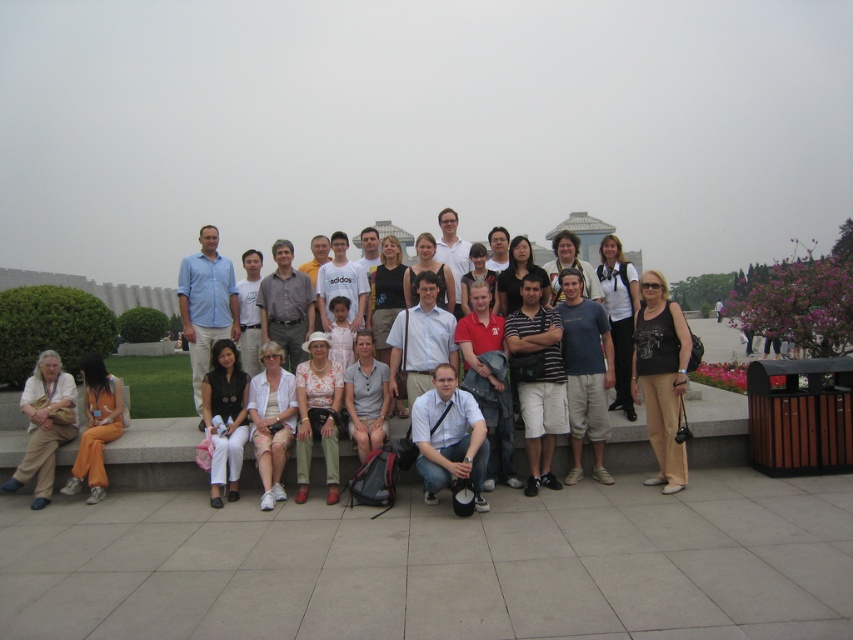
Question: Which point is closer to the camera?

Choices:
 (A) (53, 461)
 (B) (68, 488)

Answer: (B)

Question: Does light beige pants at lower left appear under orange cotton pants at lower left?

Choices:
 (A) no
 (B) yes

Answer: (A)

Question: Is light beige pants at lower left bigger than orange cotton pants at lower left?

Choices:
 (A) no
 (B) yes

Answer: (A)

Question: Which point appears farthest from the camera in this image?

Choices:
 (A) (109, 426)
 (B) (47, 406)

Answer: (A)

Question: Is light beige pants at lower left wider than orange cotton pants at lower left?

Choices:
 (A) no
 (B) yes

Answer: (A)

Question: Which point is closer to the camera taking this photo?

Choices:
 (A) (86, 404)
 (B) (53, 392)

Answer: (B)